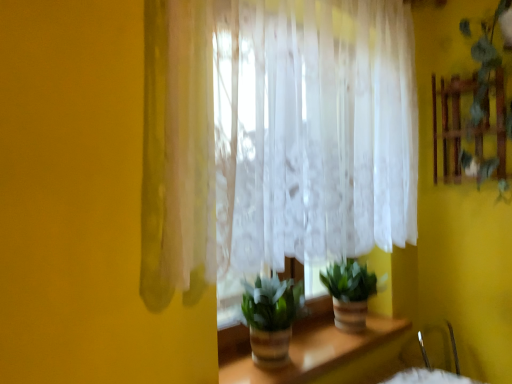
The height and width of the screenshot is (384, 512). What are the coordinates of `vacant area that lies between green matte plant at center, the first houseplant positioned from the front, and green matte plant at center, placed as the 1th houseplant when sorted from back to front` in the screenshot? It's located at (323, 344).